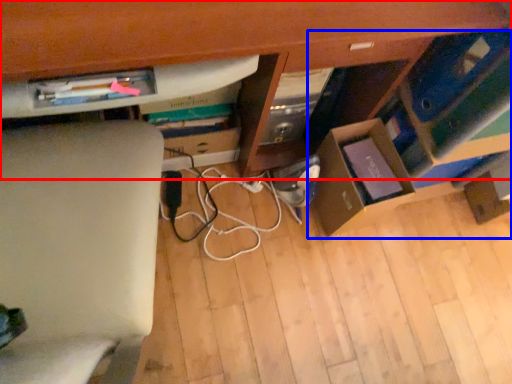
Question: Which of the following is the farthest to the observer, computer desk (highlighted by a red box) or shelf (highlighted by a blue box)?

Choices:
 (A) computer desk
 (B) shelf

Answer: (B)